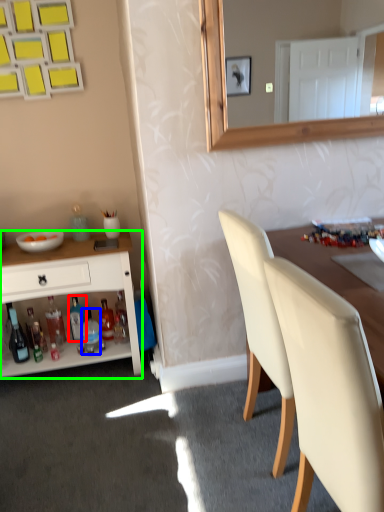
Question: Considering the real-world distances, which object is farthest from bottle (highlighted by a red box)? bottle (highlighted by a blue box) or cabinetry (highlighted by a green box)?

Choices:
 (A) bottle
 (B) cabinetry

Answer: (B)